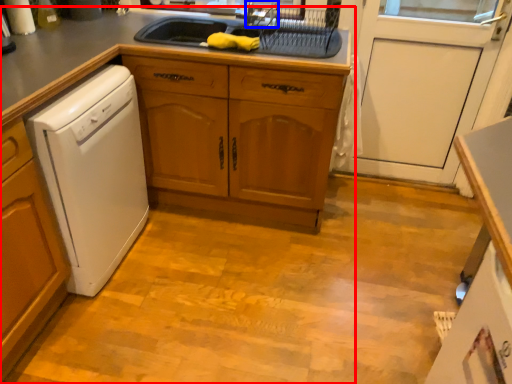
Question: Which object is closer to the camera taking this photo, countertop (highlighted by a red box) or faucet (highlighted by a blue box)?

Choices:
 (A) countertop
 (B) faucet

Answer: (A)